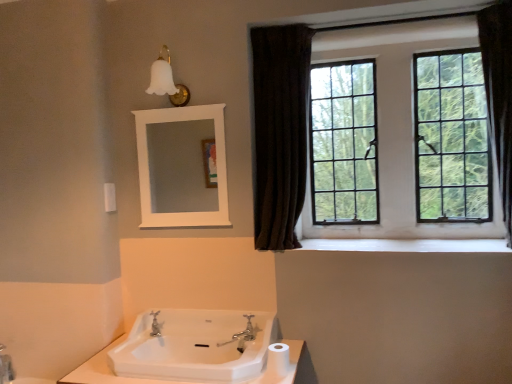
Question: Is white plastic towel bar at upper left positioned with its back to silver metallic faucet at center?

Choices:
 (A) yes
 (B) no

Answer: (B)

Question: Is white plastic towel bar at upper left far from silver metallic faucet at center?

Choices:
 (A) yes
 (B) no

Answer: (B)

Question: From a real-world perspective, is white plastic towel bar at upper left on top of silver metallic faucet at center?

Choices:
 (A) no
 (B) yes

Answer: (B)

Question: From a real-world perspective, is white plastic towel bar at upper left located beneath silver metallic faucet at center?

Choices:
 (A) yes
 (B) no

Answer: (B)

Question: From the image's perspective, is white plastic towel bar at upper left located above silver metallic faucet at center?

Choices:
 (A) yes
 (B) no

Answer: (A)

Question: Would you say white matte toilet paper at lower center is inside or outside brown fabric curtain at right?

Choices:
 (A) outside
 (B) inside

Answer: (A)

Question: In terms of size, does white matte toilet paper at lower center appear bigger or smaller than brown fabric curtain at right?

Choices:
 (A) small
 (B) big

Answer: (A)

Question: Is white matte toilet paper at lower center in front of or behind brown fabric curtain at right in the image?

Choices:
 (A) front
 (B) behind

Answer: (A)

Question: Would you say white matte toilet paper at lower center is to the left or to the right of brown fabric curtain at right in the picture?

Choices:
 (A) right
 (B) left

Answer: (B)

Question: Which is correct: silver metallic tap at lower center is inside white wooden mirror at upper center, or outside of it?

Choices:
 (A) inside
 (B) outside

Answer: (B)

Question: In terms of height, does silver metallic tap at lower center look taller or shorter compared to white wooden mirror at upper center?

Choices:
 (A) tall
 (B) short

Answer: (B)

Question: Is point (154, 322) positioned closer to the camera than point (151, 190)?

Choices:
 (A) closer
 (B) farther

Answer: (A)

Question: In the image, is silver metallic tap at lower center positioned in front of or behind white wooden mirror at upper center?

Choices:
 (A) front
 (B) behind

Answer: (A)

Question: From the image's perspective, is white plastic towel bar at upper left positioned above or below black glass window at upper right?

Choices:
 (A) above
 (B) below

Answer: (B)

Question: In terms of width, does white plastic towel bar at upper left look wider or thinner when compared to black glass window at upper right?

Choices:
 (A) wide
 (B) thin

Answer: (B)